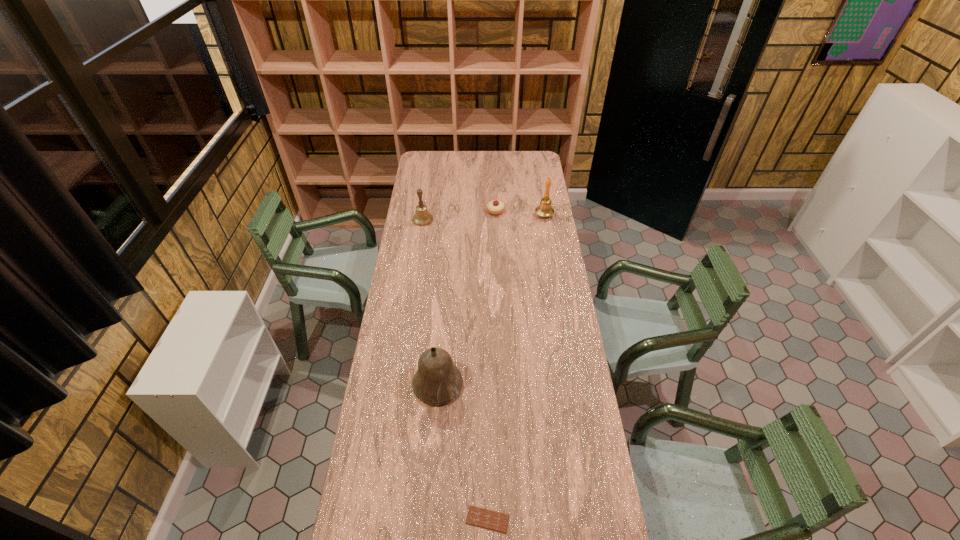
Find the location of a particular element. The height and width of the screenshot is (540, 960). vacant space at the far edge of the desktop is located at coordinates (465, 167).

Where is `free space at the left edge`? The image size is (960, 540). free space at the left edge is located at coordinates (392, 328).

Locate an element on the screen. The width and height of the screenshot is (960, 540). free space at the right edge is located at coordinates (532, 191).

The height and width of the screenshot is (540, 960). Find the location of `free space at the far left corner of the desktop`. free space at the far left corner of the desktop is located at coordinates (432, 156).

You are a GUI agent. You are given a task and a screenshot of the screen. Output one action in this format:
    pyautogui.click(x=<x>, y=<y>)
    Task: Click on the free space between the nearest bell and the second shortest object
    The height and width of the screenshot is (540, 960).
    Given the screenshot: What is the action you would take?
    pyautogui.click(x=467, y=298)

This screenshot has width=960, height=540. I want to click on free spot between the nearest bell and the rightmost object, so click(491, 300).

Where is `free space between the nearest object and the nearest bell`? free space between the nearest object and the nearest bell is located at coordinates (463, 452).

Identify the location of free space between the rightmost object and the nearest object. (516, 367).

This screenshot has width=960, height=540. What are the coordinates of `free spot between the rightmost object and the shortest object` in the screenshot? It's located at (516, 367).

The image size is (960, 540). What are the coordinates of `vacant region between the shortest object and the rightmost bell` in the screenshot? It's located at (516, 367).